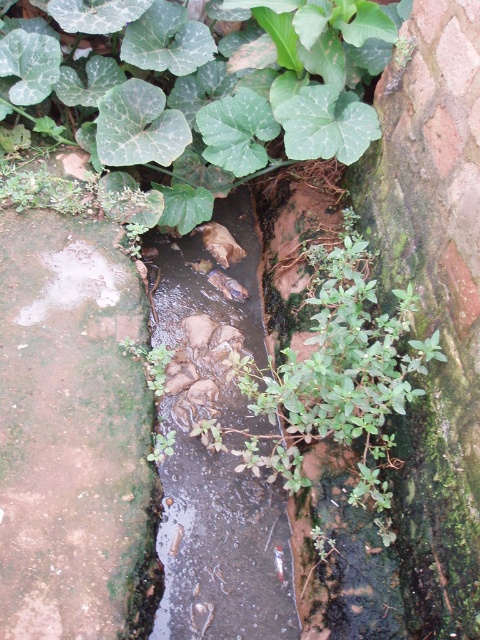
Between point (269, 84) and point (180, 561), which one is positioned behind?

The point (269, 84) is behind.

Who is more distant from viewer, [37,54] or [187,253]?

The point [187,253] is behind.

Identify the location of green leafy plant at upper center. The image size is (480, 640). (202, 90).